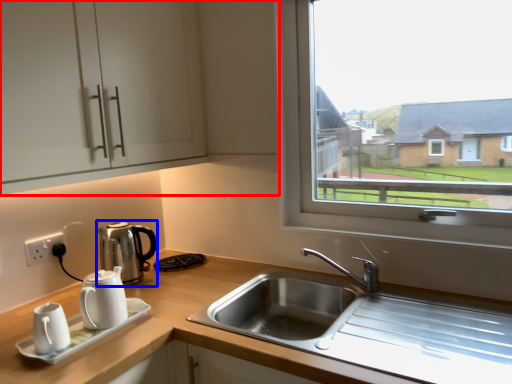
Question: Among these objects, which one is farthest to the camera, cabinetry (highlighted by a red box) or coffeepot (highlighted by a blue box)?

Choices:
 (A) cabinetry
 (B) coffeepot

Answer: (B)